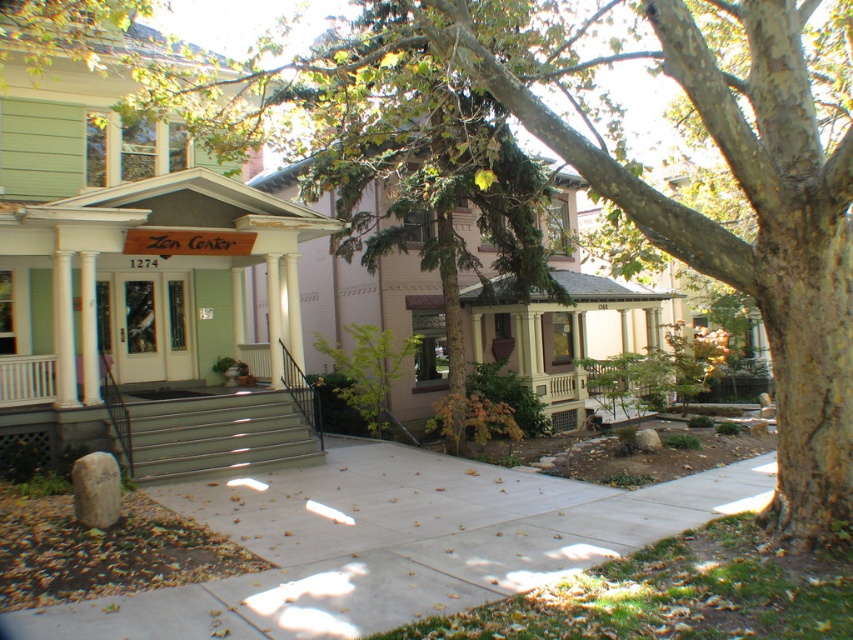
You are a delivery person trying to reach the address 1274. You see the concrete at center and the metallic gray steps at center. Which one should you step on to reach the house with the Zen Center sign?

The concrete at center is smaller than the metallic gray steps at center. Since the Zen Center is on the left house, you should step on the metallic gray steps at center leading to it.

You are standing on the sidewalk in front of the two houses and want to enter the Zen Center. The entrance is marked by the sign above the concrete at center. Which direction should you move relative to the metallic gray steps at center to reach the entrance?

You should move to the left of the metallic gray steps at center because the concrete at center, which marks the entrance to the Zen Center, is located to the right of the metallic gray steps at center. Since you want to reach the entrance, you need to position yourself on the left side relative to the steps to face the concrete area directly.